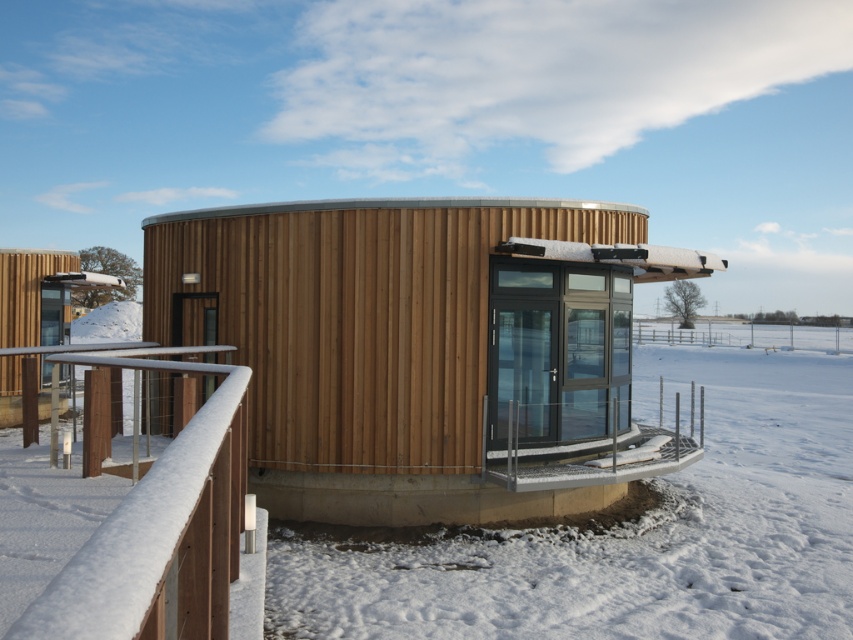
You are standing in front of the circular wooden building and notice two points marked on the structure. The first point is at coordinate point (292, 602) and the second is at point (100, 602). Which point is closer to your current position?

Point (100, 602) is closer to your current position because it is nearer to the camera compared to point (292, 602), which is further away.

You are standing at the entrance of the circular wooden structure and want to know what is located at the coordinates point (628, 528). Can you tell me what is at that point?

The point (628, 528) corresponds to white powdery snow at center.

You are standing on the wooden at left and want to walk to the white powdery snow at center. Which direction should you go to move towards the higher ground?

The white powdery snow at center has a greater height compared to wooden at left, so you should move towards the white powdery snow at center to reach higher ground.